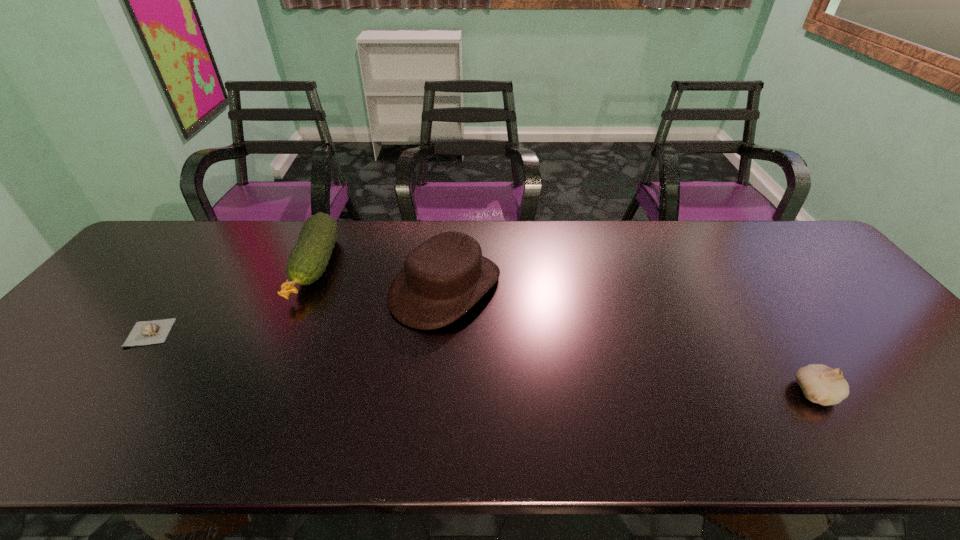
This screenshot has width=960, height=540. I want to click on vacant area that lies between the third object from right to left and the tallest object, so click(380, 277).

What are the coordinates of `vacant region between the cucumber and the left garlic` in the screenshot? It's located at (232, 300).

Identify the location of free spot between the third object from right to left and the shortest object. (232, 300).

Find the location of a particular element. Image resolution: width=960 pixels, height=540 pixels. empty space between the farther garlic and the third object from left to right is located at coordinates (298, 310).

Where is `free space between the nearest object and the cucumber`? Image resolution: width=960 pixels, height=540 pixels. free space between the nearest object and the cucumber is located at coordinates (565, 329).

Locate an element on the screen. empty space that is in between the taller garlic and the tallest object is located at coordinates (631, 340).

The height and width of the screenshot is (540, 960). Identify the location of vacant area that lies between the cucumber and the taller garlic. (565, 329).

Find the location of a particular element. The width and height of the screenshot is (960, 540). empty space that is in between the hat and the right garlic is located at coordinates (631, 340).

What are the coordinates of `blank region between the taller garlic and the hat` in the screenshot? It's located at (631, 340).

Locate an element on the screen. The height and width of the screenshot is (540, 960). object that is the third closest one to the taller garlic is located at coordinates (150, 332).